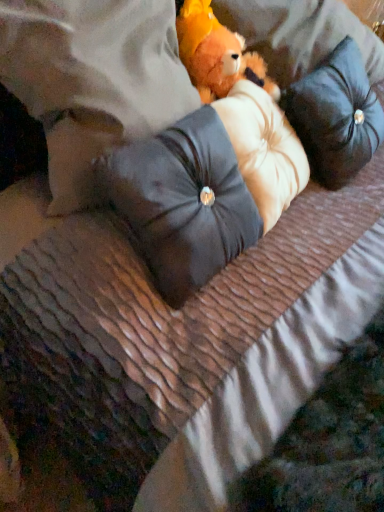
Question: In terms of height, does fluffy orange teddy bear at center look taller or shorter compared to satin black pillow at center, which ranks as the second pillow in left-to-right order?

Choices:
 (A) tall
 (B) short

Answer: (B)

Question: From the image's perspective, is fluffy orange teddy bear at center above or below satin black pillow at center, the second pillow when ordered from right to left?

Choices:
 (A) above
 (B) below

Answer: (A)

Question: Considering the real-world distances, which object is farthest from the black velvet pillow at upper right, placed as the 1th pillow when sorted from right to left?

Choices:
 (A) leather-like pillow at center, the third pillow from the right
 (B) fluffy orange teddy bear at center
 (C) satin black pillow at center, the second pillow when ordered from right to left

Answer: (A)

Question: Which of these objects is positioned farthest from the black velvet pillow at upper right, the 3th pillow when ordered from left to right?

Choices:
 (A) leather-like pillow at center, which is counted as the first pillow, starting from the left
 (B) satin black pillow at center, which ranks as the second pillow in left-to-right order
 (C) fluffy orange teddy bear at center

Answer: (A)